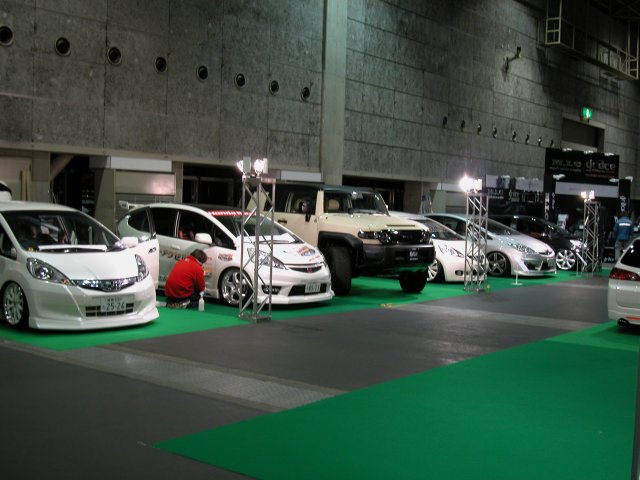
Where is `wall`? The width and height of the screenshot is (640, 480). wall is located at coordinates (410, 122).